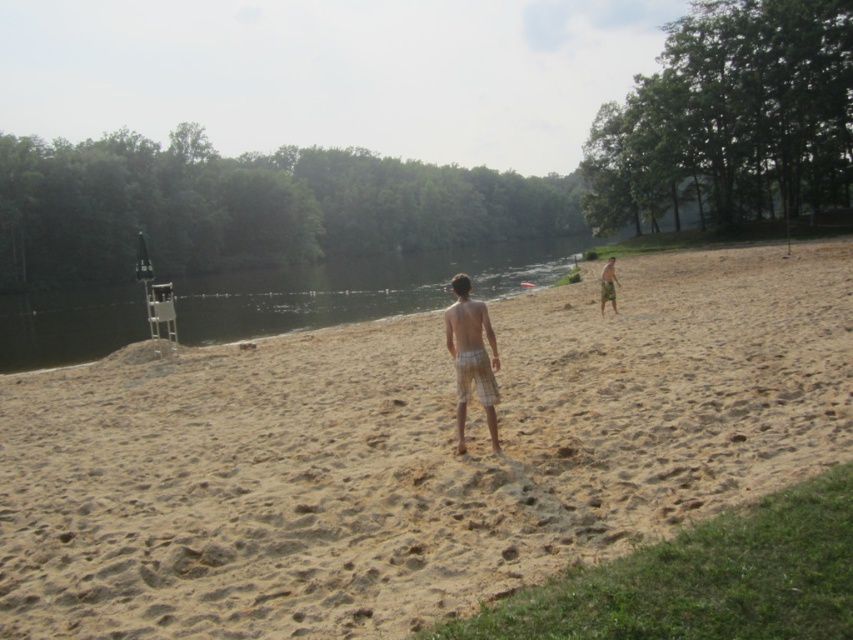
Looking at this image, does white plaid shorts at center appear under beige plaid shorts at center?

Yes, white plaid shorts at center is below beige plaid shorts at center.

Does white plaid shorts at center come behind beige plaid shorts at center?

No, it is in front of beige plaid shorts at center.

Is point (485, 332) positioned after point (606, 262)?

No, (485, 332) is closer to viewer.

This screenshot has height=640, width=853. Find the location of `white plaid shorts at center`. white plaid shorts at center is located at coordinates (471, 356).

Is clear water at center bigger than beige plaid shorts at center?

Indeed, clear water at center has a larger size compared to beige plaid shorts at center.

Is clear water at center thinner than beige plaid shorts at center?

No, clear water at center is not thinner than beige plaid shorts at center.

Does point (277, 291) come closer to viewer compared to point (608, 266)?

That is False.

Where is `clear water at center`? clear water at center is located at coordinates (358, 288).

Does brown sandy beach at center have a larger size compared to white plaid shorts at center?

Correct, brown sandy beach at center is larger in size than white plaid shorts at center.

Between brown sandy beach at center and white plaid shorts at center, which one has more height?

brown sandy beach at center is taller.

Between point (212, 490) and point (451, 317), which one is positioned in front?

Point (212, 490) is in front.

Image resolution: width=853 pixels, height=640 pixels. In order to click on brown sandy beach at center in this screenshot , I will do `click(413, 452)`.